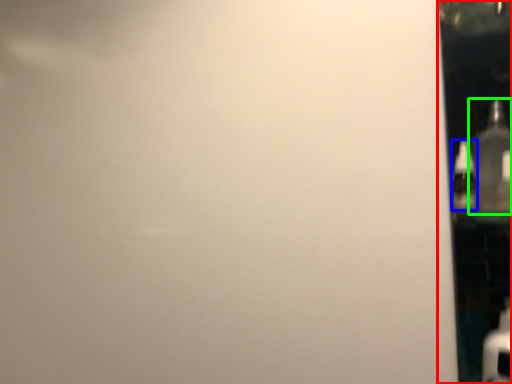
Question: Which object is positioned closest to glass door (highlighted by a red box)? Select from bottle (highlighted by a blue box) and bottle (highlighted by a green box).

Choices:
 (A) bottle
 (B) bottle

Answer: (B)